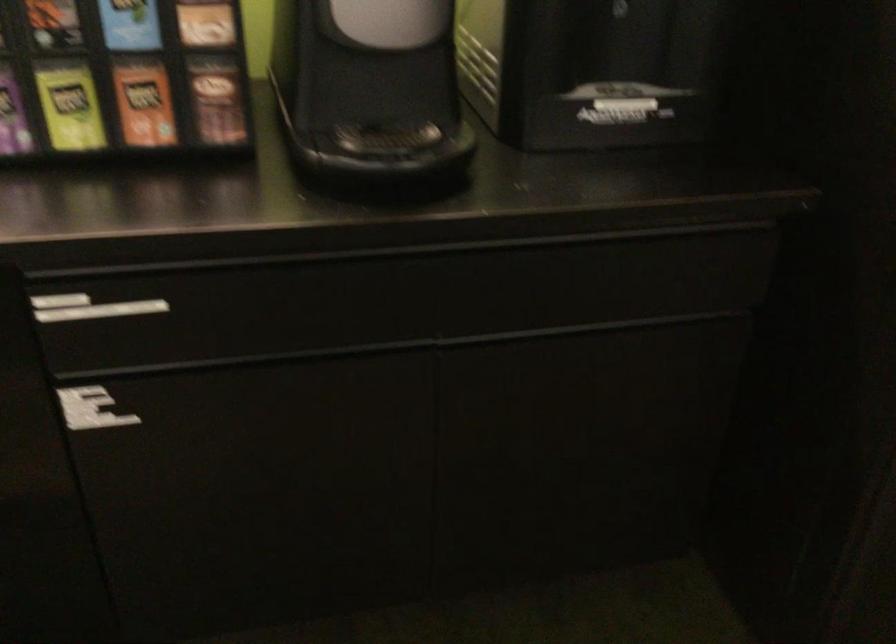
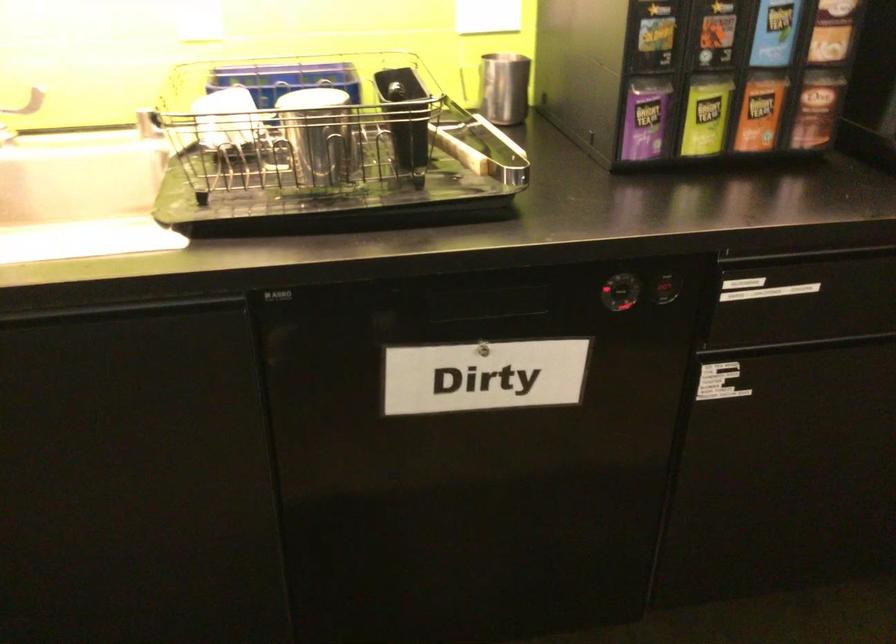
In the second image, find the point that corresponds to the point at 148,267 in the first image.

(807, 254)